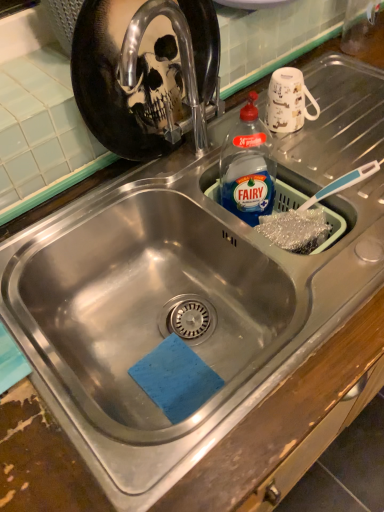
What do you see at coordinates (248, 167) in the screenshot?
I see `blue plastic bottle at upper right` at bounding box center [248, 167].

Identify the location of blue plastic bottle at upper right. Image resolution: width=384 pixels, height=512 pixels. (x=248, y=167).

Find the location of `blue plastic bottle at upper right`. blue plastic bottle at upper right is located at coordinates (248, 167).